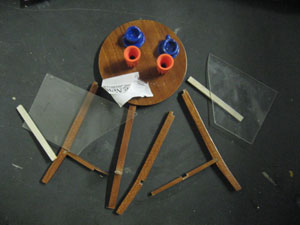
You are a GUI agent. You are given a task and a screenshot of the screen. Output one action in this format:
    pyautogui.click(x=<x>, y=<y>)
    Task: Click on the left orange cup
    
    Given the screenshot: What is the action you would take?
    pyautogui.click(x=131, y=60)